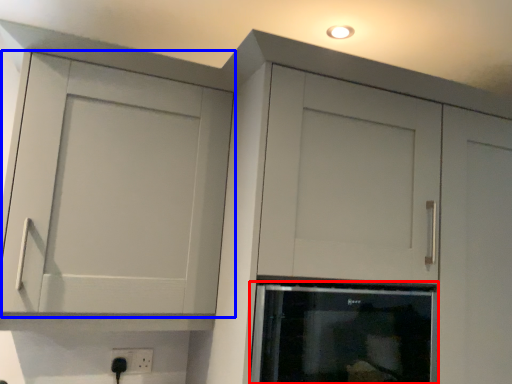
Question: Which object appears farthest to the camera in this image, appliance (highlighted by a red box) or cupboard (highlighted by a blue box)?

Choices:
 (A) appliance
 (B) cupboard

Answer: (A)